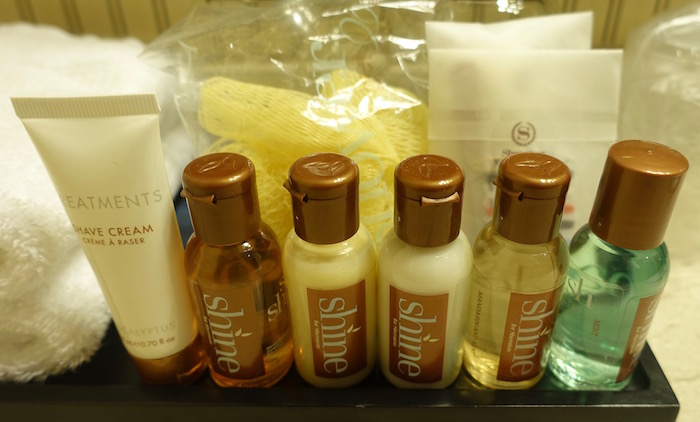
The height and width of the screenshot is (422, 700). I want to click on bottle, so point(228,303), point(412,306), point(528,306), point(612,298), point(332,310).